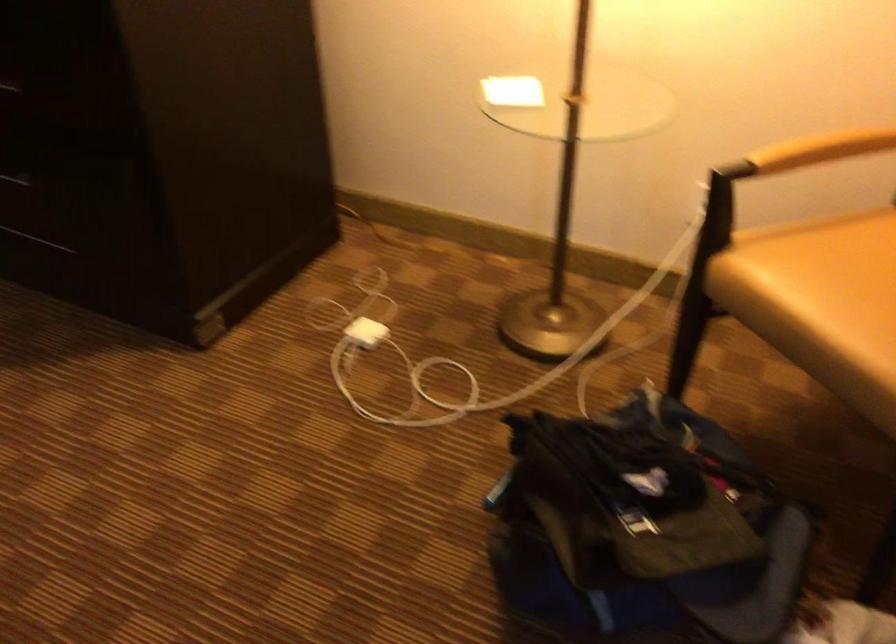
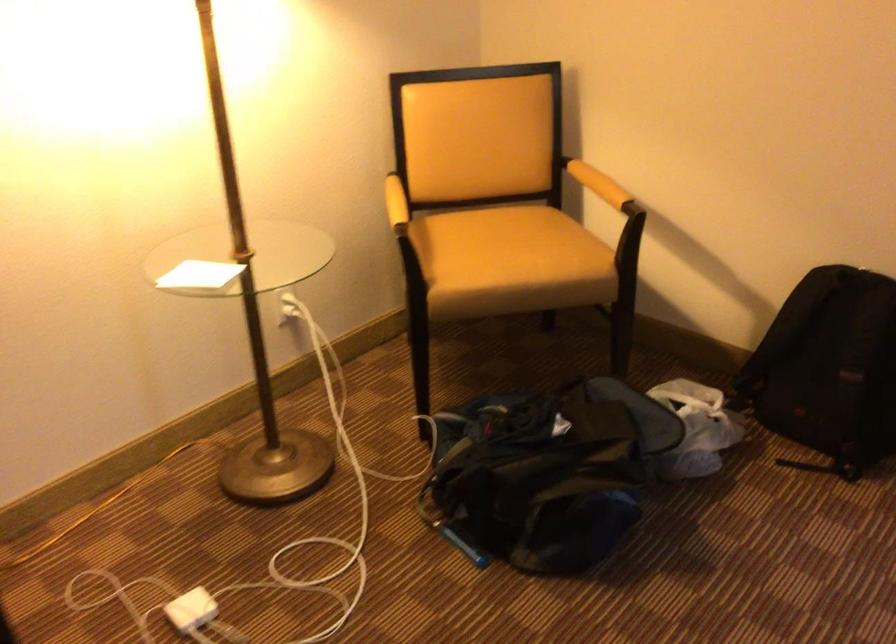
Where in the second image is the point corresponding to (x=500, y=91) from the first image?

(199, 275)